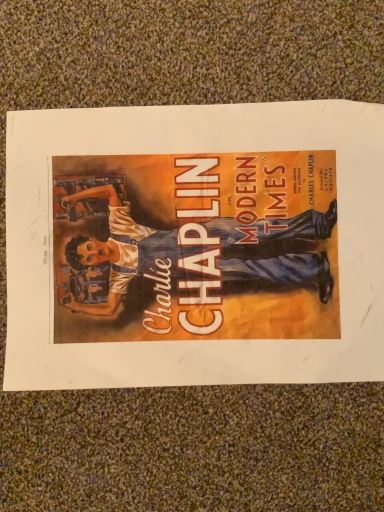
The height and width of the screenshot is (512, 384). I want to click on matte paper poster at center, so click(x=195, y=245).

Image resolution: width=384 pixels, height=512 pixels. Describe the element at coordinates (195, 245) in the screenshot. I see `matte paper poster at center` at that location.

At what (x,y) coordinates should I click in order to perform the action: click on matte paper poster at center. Please return your answer as a coordinate pair (x, y). The image size is (384, 512). Looking at the image, I should click on (195, 245).